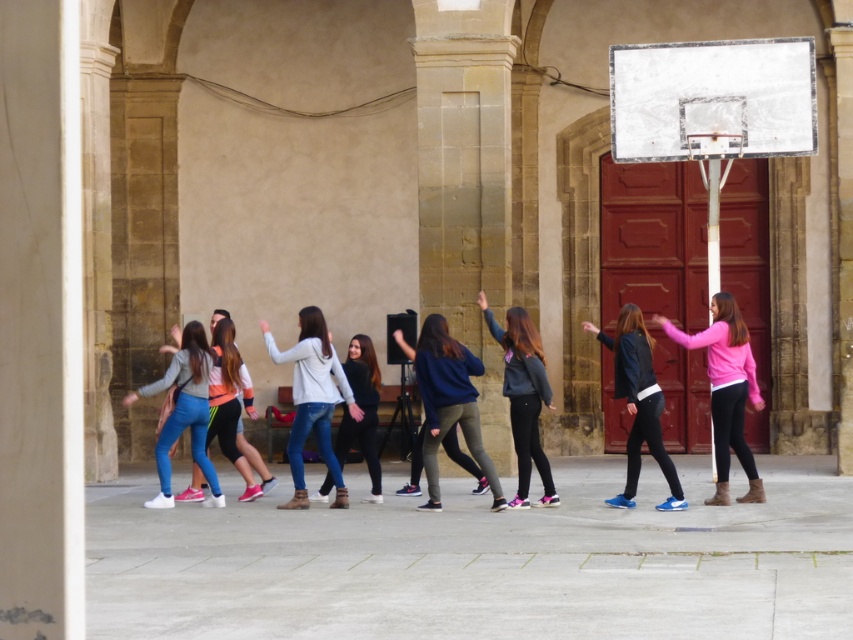
Is point (728, 396) positioned after point (653, 436)?

No, it is not.

Who is more forward, (756, 500) or (686, 502)?

Point (686, 502)

Locate an element on the screen. The image size is (853, 640). pink matte sweater at center is located at coordinates (726, 388).

Is matte black jacket at center thinner than jeans at center?

No.

Does matte black jacket at center have a lesser height compared to jeans at center?

No.

Between point (654, 440) and point (372, 476), which one is positioned in front?

Point (654, 440) is more forward.

Locate an element on the screen. The width and height of the screenshot is (853, 640). matte black jacket at center is located at coordinates (637, 403).

Which is in front, point (318, 362) or point (318, 492)?

Point (318, 362)

Is light gray denim jeans at center in front of jeans at center?

Yes, it is in front of jeans at center.

The height and width of the screenshot is (640, 853). Find the location of `light gray denim jeans at center`. light gray denim jeans at center is located at coordinates (312, 400).

What are the coordinates of `light gray denim jeans at center` in the screenshot? It's located at (312, 400).